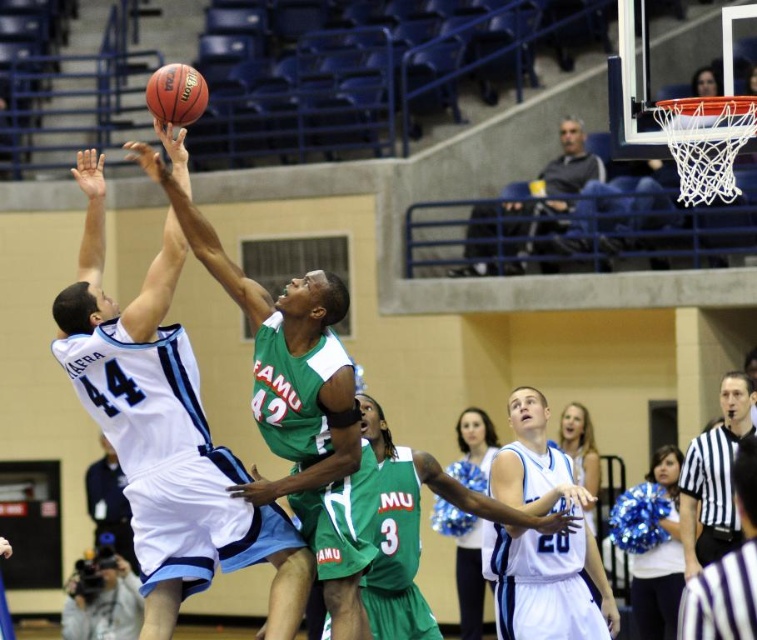
Does green matte basketball player at center have a greater height compared to black and white striped shirt at lower right?

Correct, green matte basketball player at center is much taller as black and white striped shirt at lower right.

Can you confirm if green matte basketball player at center is shorter than black and white striped shirt at lower right?

Incorrect, green matte basketball player at center's height does not fall short of black and white striped shirt at lower right's.

Does point (217, 518) lie in front of point (734, 376)?

Yes, it is in front of point (734, 376).

Identify the location of green matte basketball player at center. (167, 426).

Does dark gray sweater at upper center lie in front of gray fabric camera at lower left?

That is True.

Is dark gray sweater at upper center above gray fabric camera at lower left?

Indeed, dark gray sweater at upper center is positioned over gray fabric camera at lower left.

Identify the location of dark gray sweater at upper center. (x=528, y=211).

Which is behind, point (740, 394) or point (164, 115)?

The point (740, 394) is more distant.

Between black and white striped shirt at lower right and rubber textured basketball at upper left, which one appears on the right side from the viewer's perspective?

black and white striped shirt at lower right is more to the right.

Locate an element on the screen. black and white striped shirt at lower right is located at coordinates (712, 480).

In order to click on black and white striped shirt at lower right in this screenshot , I will do `click(712, 480)`.